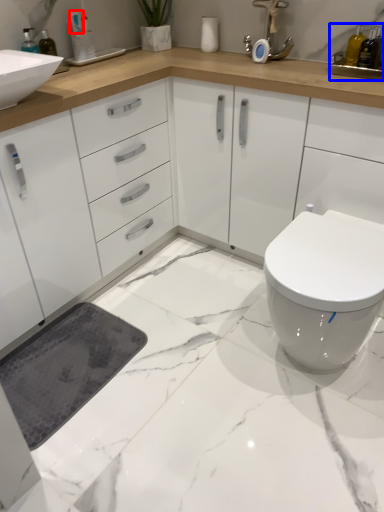
Question: Which object appears closest to the camera in this image, toiletry (highlighted by a red box) or sink (highlighted by a blue box)?

Choices:
 (A) toiletry
 (B) sink

Answer: (B)